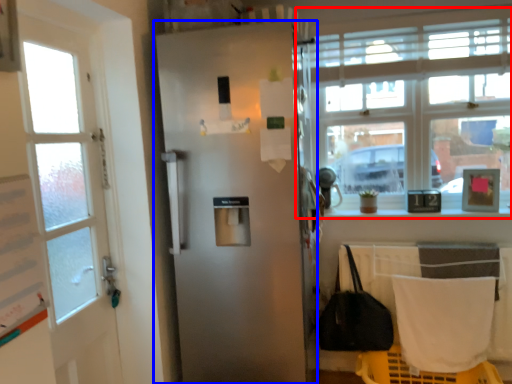
Question: Which point is closer to the camera, window (highlighted by a red box) or door (highlighted by a blue box)?

Choices:
 (A) window
 (B) door

Answer: (B)